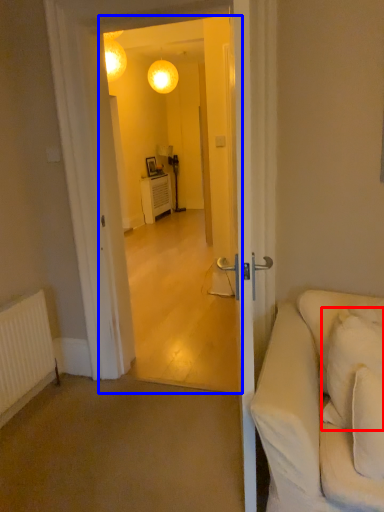
Question: Among these objects, which one is farthest to the camera, pillow (highlighted by a red box) or screen door (highlighted by a blue box)?

Choices:
 (A) pillow
 (B) screen door

Answer: (B)